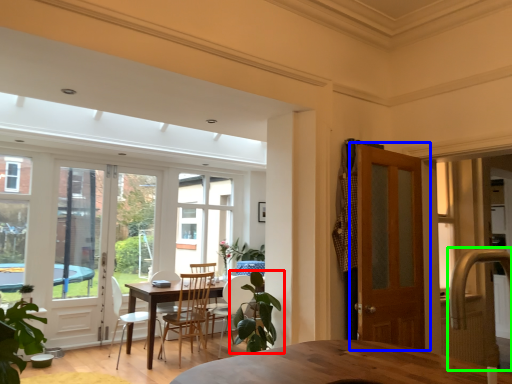
Question: Estimate the real-world distances between objects in this image. Which object is farther from houseplant (highlighted by a red box), door (highlighted by a blue box) or faucet (highlighted by a green box)?

Choices:
 (A) door
 (B) faucet

Answer: (B)